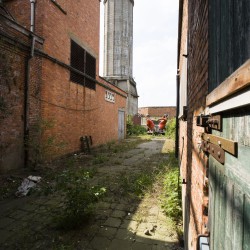
The width and height of the screenshot is (250, 250). Find the location of `door`. door is located at coordinates (121, 125), (231, 183).